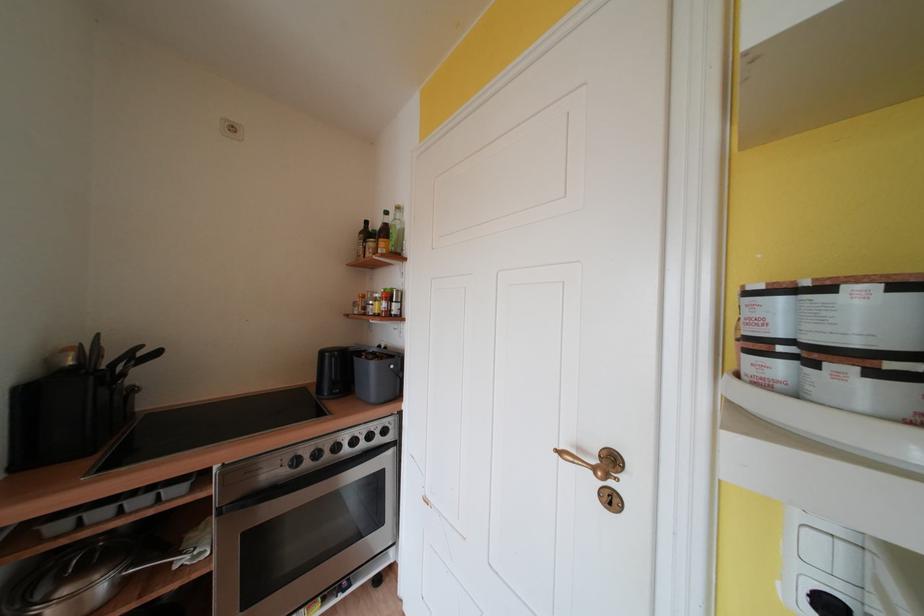
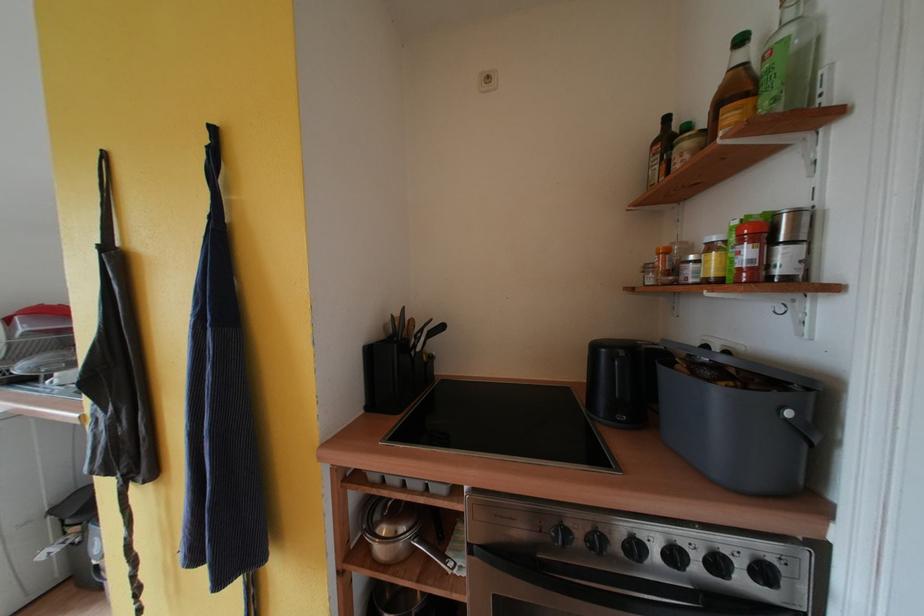
The point at [148,350] is marked in the first image. Where is the corresponding point in the second image?

(436, 323)